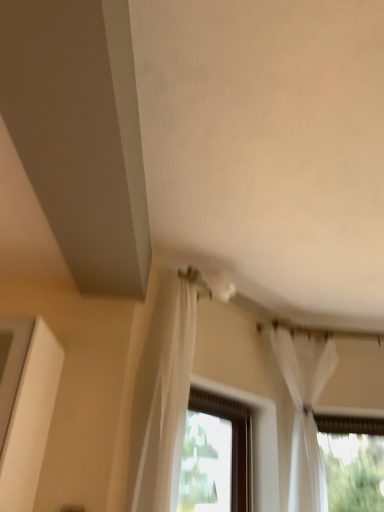
Question: Is brown wooden window at center touching white sheer curtain at upper right?

Choices:
 (A) yes
 (B) no

Answer: (B)

Question: Is brown wooden window at center completely or partially outside of white sheer curtain at upper right?

Choices:
 (A) yes
 (B) no

Answer: (A)

Question: From a real-world perspective, is brown wooden window at center on top of white sheer curtain at upper right?

Choices:
 (A) no
 (B) yes

Answer: (A)

Question: Is brown wooden window at center oriented away from white sheer curtain at upper right?

Choices:
 (A) yes
 (B) no

Answer: (B)

Question: Considering the relative sizes of brown wooden window at center and white sheer curtain at upper right in the image provided, is brown wooden window at center thinner than white sheer curtain at upper right?

Choices:
 (A) no
 (B) yes

Answer: (B)

Question: Is brown wooden window at center smaller than white sheer curtain at upper right?

Choices:
 (A) yes
 (B) no

Answer: (A)

Question: Does white sheer curtain at upper right appear on the right side of brown wooden window at center?

Choices:
 (A) no
 (B) yes

Answer: (B)

Question: Does white sheer curtain at upper right have a greater height compared to brown wooden window at center?

Choices:
 (A) no
 (B) yes

Answer: (B)

Question: Does white sheer curtain at upper right have a larger size compared to brown wooden window at center?

Choices:
 (A) yes
 (B) no

Answer: (A)

Question: Does white sheer curtain at upper right touch brown wooden window at center?

Choices:
 (A) no
 (B) yes

Answer: (A)

Question: Can you confirm if white sheer curtain at upper right is shorter than brown wooden window at center?

Choices:
 (A) no
 (B) yes

Answer: (A)

Question: Is white sheer curtain at upper right not inside brown wooden window at center?

Choices:
 (A) yes
 (B) no

Answer: (A)

Question: In the image, is brown wooden window at center on the left side or the right side of white sheer curtain at upper right?

Choices:
 (A) right
 (B) left

Answer: (B)